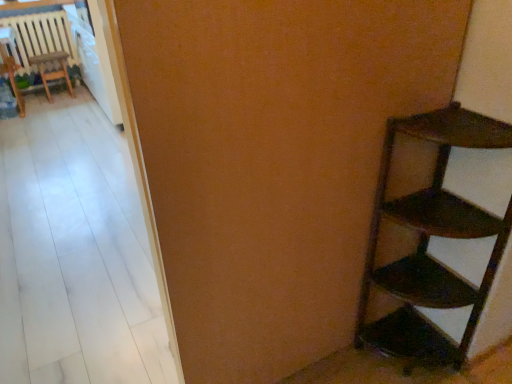
Where is `wooden chair at left`? The width and height of the screenshot is (512, 384). wooden chair at left is located at coordinates (53, 70).

Describe the element at coordinates (53, 70) in the screenshot. I see `wooden chair at left` at that location.

Where is `wooden chair at left`? wooden chair at left is located at coordinates (53, 70).